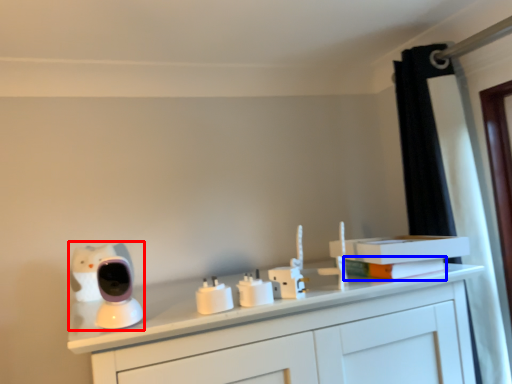
Question: Which object is further to the camera taking this photo, toy (highlighted by a red box) or book (highlighted by a blue box)?

Choices:
 (A) toy
 (B) book

Answer: (B)